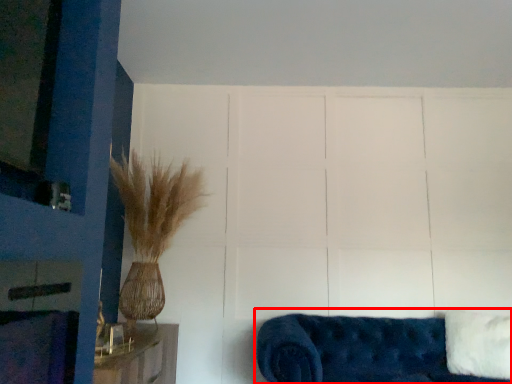
Question: From the image's perspective, what is the correct spatial relationship of studio couch (annotated by the red box) in relation to pillow?

Choices:
 (A) above
 (B) below

Answer: (B)